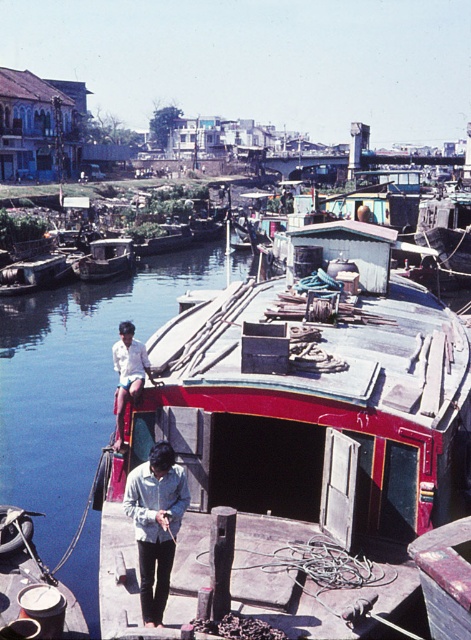
Between red painted wood boat at center and white cotton shirt at upper left, which one appears on the right side from the viewer's perspective?

From the viewer's perspective, red painted wood boat at center appears more on the right side.

Does red painted wood boat at center come behind white cotton shirt at upper left?

No.

What do you see at coordinates (301, 440) in the screenshot? I see `red painted wood boat at center` at bounding box center [301, 440].

The width and height of the screenshot is (471, 640). Identify the location of red painted wood boat at center. (301, 440).

Can you confirm if light blue denim shirt at center is positioned above wooden boat at center?

No, light blue denim shirt at center is not above wooden boat at center.

Does light blue denim shirt at center come behind wooden boat at center?

No, it is not.

Image resolution: width=471 pixels, height=640 pixels. In order to click on light blue denim shirt at center in this screenshot , I will do `click(155, 524)`.

This screenshot has width=471, height=640. What are the coordinates of `light blue denim shirt at center` in the screenshot? It's located at 155,524.

Describe the element at coordinates (155, 524) in the screenshot. I see `light blue denim shirt at center` at that location.

Does light blue denim shirt at center have a larger size compared to white cotton shirt at upper left?

Yes, light blue denim shirt at center is bigger than white cotton shirt at upper left.

You are a GUI agent. You are given a task and a screenshot of the screen. Output one action in this format:
    pyautogui.click(x=<x>, y=<y>)
    Task: Click on the light blue denim shirt at center
    Image resolution: width=471 pixels, height=640 pixels.
    Given the screenshot: What is the action you would take?
    pyautogui.click(x=155, y=524)

Locate an element on the screen. light blue denim shirt at center is located at coordinates (155, 524).